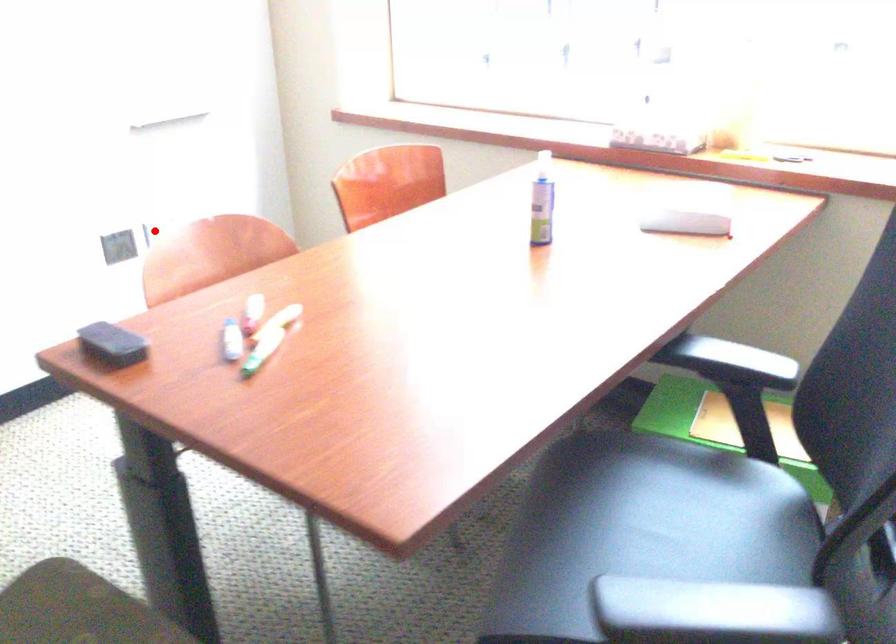
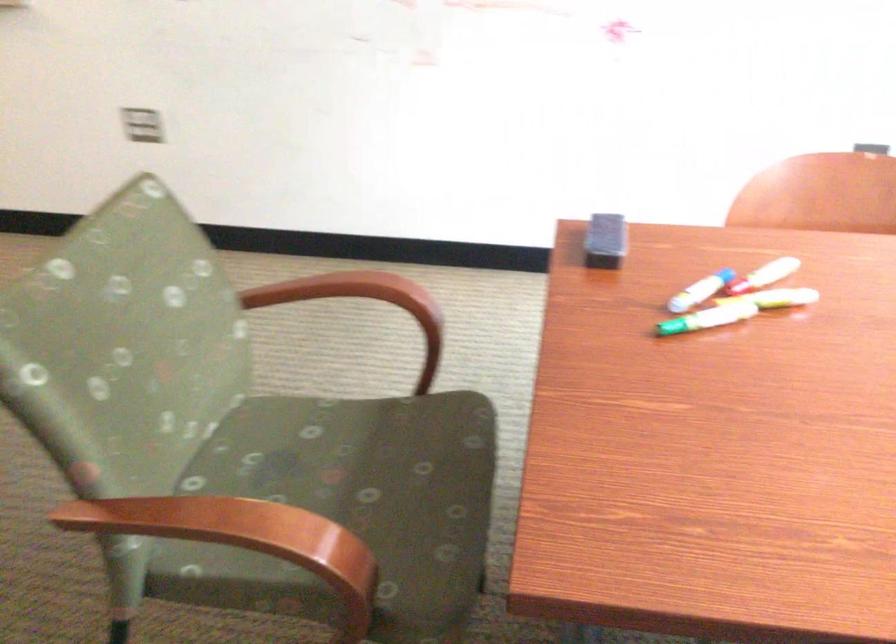
Question: I am providing you with two images of the same scene from different viewpoints. In image1, a red point is highlighted. Considering the same 3D point in image2, which of the following is correct?

Choices:
 (A) It is closer
 (B) It is farther

Answer: (A)